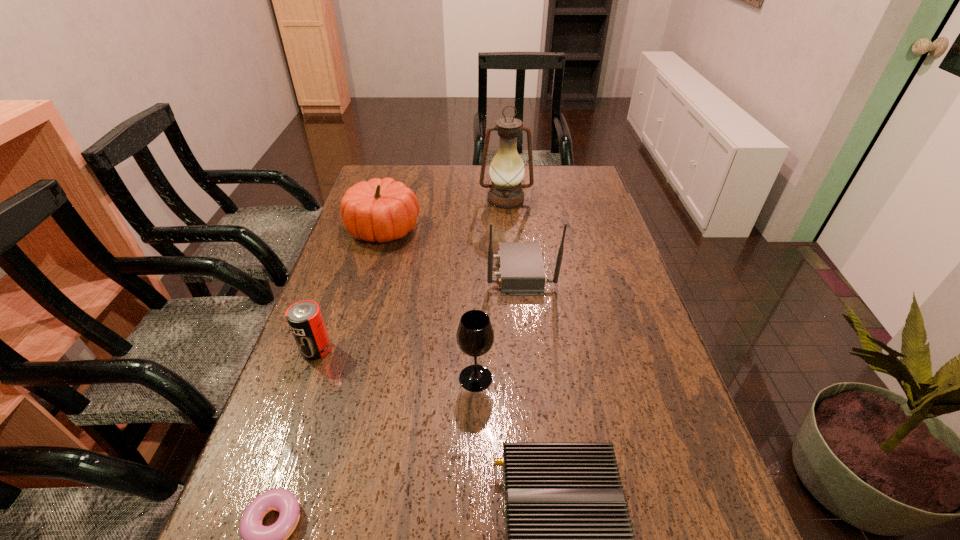
This screenshot has height=540, width=960. I want to click on free spot at the far right corner of the desktop, so click(571, 166).

Locate an element on the screen. empty location between the fifth farthest object and the second tallest object is located at coordinates (498, 325).

You are a GUI agent. You are given a task and a screenshot of the screen. Output one action in this format:
    pyautogui.click(x=<x>, y=<y>)
    Task: Click on the free space that is in between the fifth tallest object and the pumpkin
    
    Given the screenshot: What is the action you would take?
    pyautogui.click(x=349, y=289)

You are a GUI agent. You are given a task and a screenshot of the screen. Output one action in this format:
    pyautogui.click(x=<x>, y=<y>)
    Task: Click on the vacant space that's between the sixth shortest object and the tallest object
    Image resolution: width=960 pixels, height=540 pixels.
    Given the screenshot: What is the action you would take?
    pyautogui.click(x=513, y=235)

What are the coordinates of `free area in between the tallest object and the pumpkin` in the screenshot? It's located at (444, 214).

In order to click on object that stands as the sixth closest to the taller router in this screenshot , I will do `click(257, 539)`.

The height and width of the screenshot is (540, 960). In order to click on object that is the fifth closest to the wineglass in this screenshot , I will do `click(383, 210)`.

Where is `vacant region that satisfies the following two spatial constraints: 1. on the front side of the pumpkin; 2. on the right side of the fifth farthest object`? Image resolution: width=960 pixels, height=540 pixels. vacant region that satisfies the following two spatial constraints: 1. on the front side of the pumpkin; 2. on the right side of the fifth farthest object is located at coordinates (340, 378).